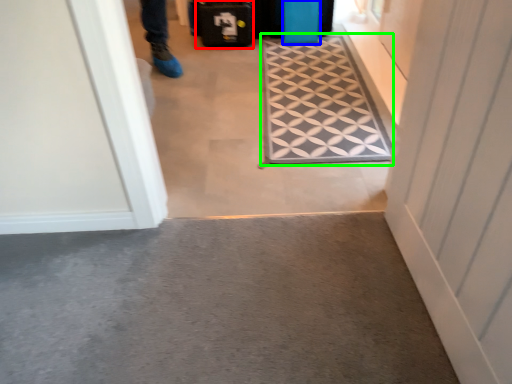
Question: Based on their relative distances, which object is nearer to luggage (highlighted by a red box)? Choose from luggage (highlighted by a blue box) and doormat (highlighted by a green box).

Choices:
 (A) luggage
 (B) doormat

Answer: (A)